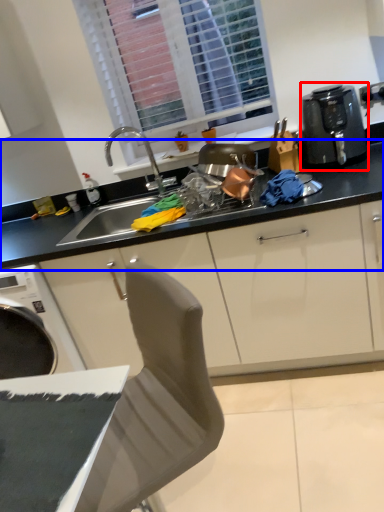
Question: Which object appears closest to the camera in this image, kitchen appliance (highlighted by a red box) or countertop (highlighted by a blue box)?

Choices:
 (A) kitchen appliance
 (B) countertop

Answer: (A)